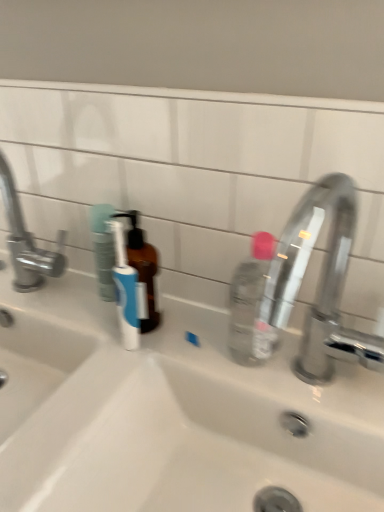
Question: Based on their positions, is polished chrome faucet at right, arranged as the 1th tap when viewed from the right, located to the left or right of brushed metal faucet at left, acting as the second tap starting from the right?

Choices:
 (A) right
 (B) left

Answer: (A)

Question: Does point (317, 207) appear closer or farther from the camera than point (8, 177)?

Choices:
 (A) closer
 (B) farther

Answer: (A)

Question: Estimate the real-world distances between objects in this image. Which object is closer to the polished chrome faucet at right, which is counted as the second tap, starting from the left?

Choices:
 (A) brushed metal faucet at left, acting as the second tap starting from the right
 (B) white ceramic sink at center

Answer: (B)

Question: Which is farther from the brushed metal faucet at left, acting as the second tap starting from the right?

Choices:
 (A) white ceramic sink at center
 (B) polished chrome faucet at right, arranged as the 1th tap when viewed from the right

Answer: (B)